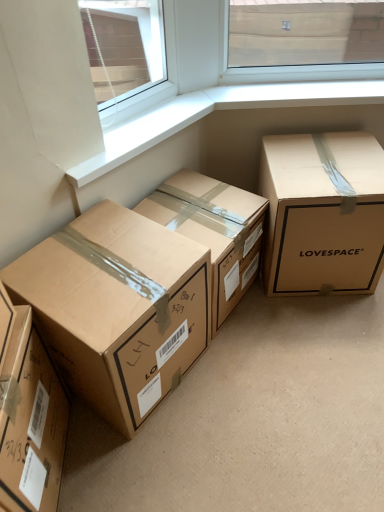
Question: Are brown cardboard box at lower left, the 3th box viewed from the right, and brown cardboard box at center, which is counted as the third box, starting from the left, far apart?

Choices:
 (A) yes
 (B) no

Answer: (B)

Question: Is brown cardboard box at lower left, which ranks as the second box in left-to-right order, shorter than brown cardboard box at center, which is counted as the third box, starting from the left?

Choices:
 (A) yes
 (B) no

Answer: (B)

Question: Does brown cardboard box at lower left, which ranks as the second box in left-to-right order, have a smaller size compared to brown cardboard box at center, which appears as the 2th box when viewed from the right?

Choices:
 (A) yes
 (B) no

Answer: (B)

Question: Is brown cardboard box at lower left, which ranks as the second box in left-to-right order, next to brown cardboard box at center, which is counted as the third box, starting from the left, and touching it?

Choices:
 (A) no
 (B) yes

Answer: (A)

Question: From a real-world perspective, is brown cardboard box at lower left, which ranks as the second box in left-to-right order, under brown cardboard box at center, which is counted as the third box, starting from the left?

Choices:
 (A) no
 (B) yes

Answer: (A)

Question: Is brown cardboard box at lower left, the 3th box viewed from the right, positioned behind brown cardboard box at center, which is counted as the third box, starting from the left?

Choices:
 (A) no
 (B) yes

Answer: (A)

Question: Considering the relative positions of matte cardboard box at right, which is counted as the 1th box, starting from the right, and brown cardboard box at center, which is counted as the third box, starting from the left, in the image provided, is matte cardboard box at right, which is counted as the 1th box, starting from the right, to the left of brown cardboard box at center, which is counted as the third box, starting from the left, from the viewer's perspective?

Choices:
 (A) no
 (B) yes

Answer: (A)

Question: Does matte cardboard box at right, which is counted as the 1th box, starting from the right, touch brown cardboard box at center, which is counted as the third box, starting from the left?

Choices:
 (A) no
 (B) yes

Answer: (A)

Question: Is brown cardboard box at center, which is counted as the third box, starting from the left, completely or partially inside matte cardboard box at right, which is counted as the 1th box, starting from the right?

Choices:
 (A) yes
 (B) no

Answer: (B)

Question: Can you confirm if matte cardboard box at right, which is counted as the 1th box, starting from the right, is wider than brown cardboard box at center, which appears as the 2th box when viewed from the right?

Choices:
 (A) yes
 (B) no

Answer: (A)

Question: From a real-world perspective, is matte cardboard box at right, the fourth box in the left-to-right sequence, located higher than brown cardboard box at center, which appears as the 2th box when viewed from the right?

Choices:
 (A) no
 (B) yes

Answer: (B)

Question: Are matte cardboard box at right, which is counted as the 1th box, starting from the right, and brown cardboard box at center, which is counted as the third box, starting from the left, located far from each other?

Choices:
 (A) no
 (B) yes

Answer: (A)

Question: Is brown cardboard box at center, which appears as the 2th box when viewed from the right, to the left of matte cardboard box at right, which is counted as the 1th box, starting from the right, from the viewer's perspective?

Choices:
 (A) no
 (B) yes

Answer: (B)